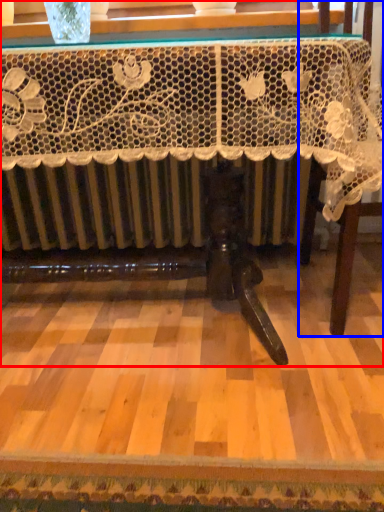
Question: Which of the following is the closest to the observer, table (highlighted by a red box) or furniture (highlighted by a blue box)?

Choices:
 (A) table
 (B) furniture

Answer: (A)